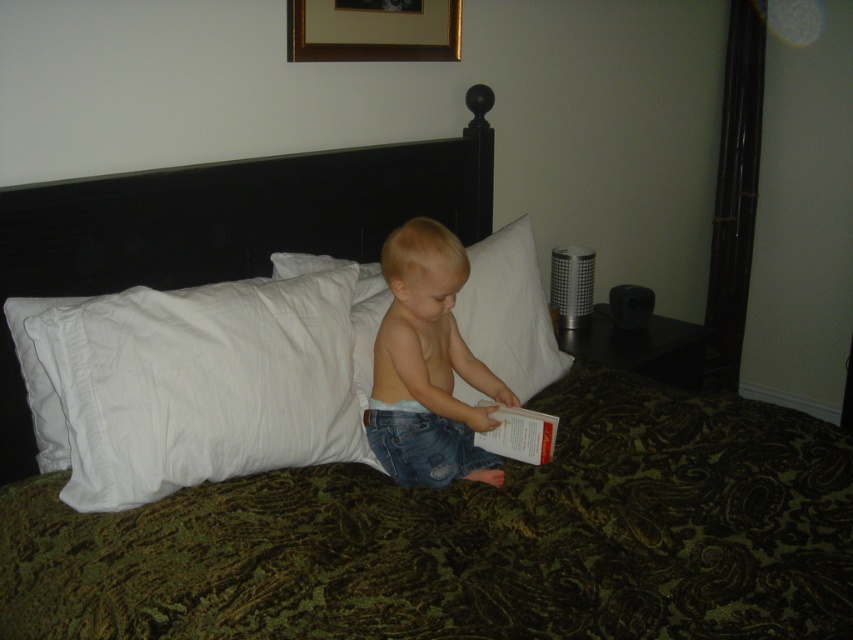
You are standing in the room and want to hang a new picture exactly where the gold wooden picture frame at upper center is currently located. What are the coordinates of the spot where you should place the nail?

The coordinates for the gold wooden picture frame at upper center are at point (373, 29), so you should place the nail at those coordinates.

What is the exact coordinate position of the denim shorts at center in the image?

The denim shorts at center is located at point (427, 365).